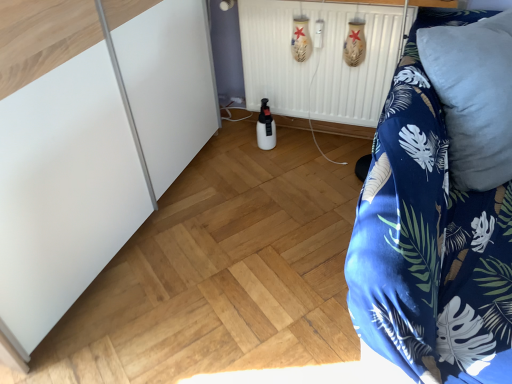
Where is `free space to the right of white matte bottle at center`? This screenshot has height=384, width=512. free space to the right of white matte bottle at center is located at coordinates (297, 141).